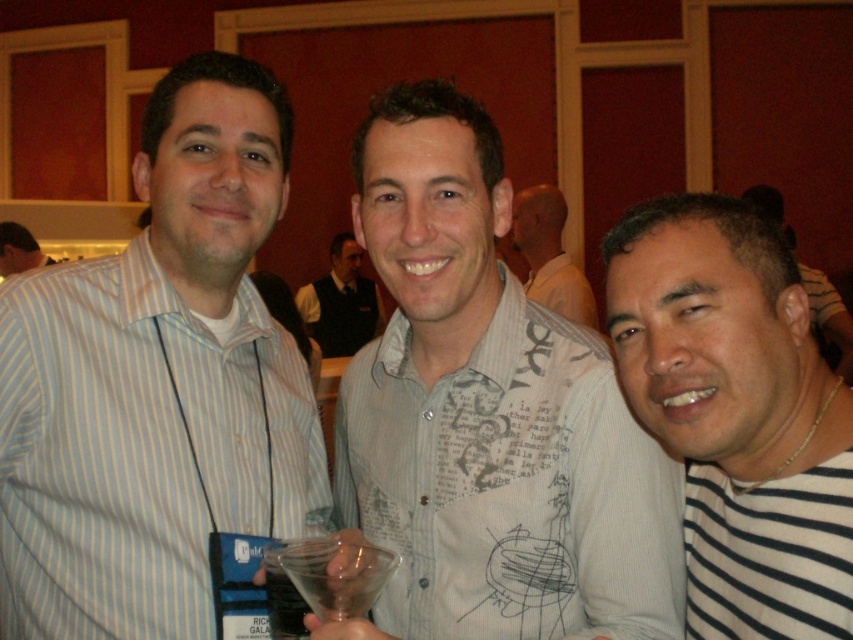
You are at a social event and need to reach for the clear plastic cup at center without touching the light gray printed shirt at center. Is this possible?

The light gray printed shirt at center is positioned over clear plastic cup at center, so you cannot reach the clear plastic cup at center without touching the light gray printed shirt at center.

You are at a social event and want to hand a drink to the person wearing the light blue striped shirt at left. Since the transparent plastic martini glass at center is already in their hand, where should you place the drink?

The light blue striped shirt at left is on the left side of the transparent plastic martini glass at center, so you should place the drink to the right of the transparent plastic martini glass at center to avoid collision.